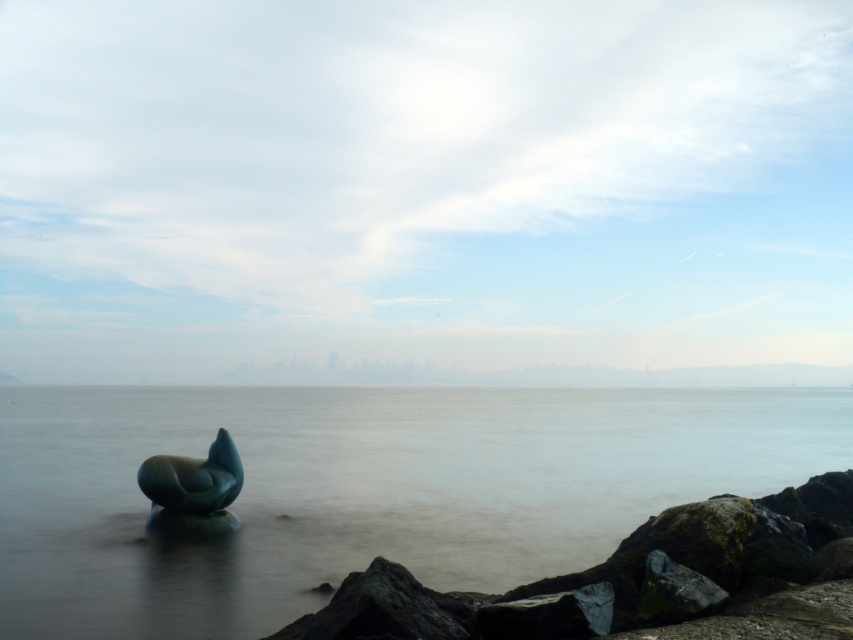
Question: Is green metallic water at center to the left of green polished stone sculpture at center from the viewer's perspective?

Choices:
 (A) no
 (B) yes

Answer: (B)

Question: Is the position of green metallic water at center less distant than that of green polished stone sculpture at center?

Choices:
 (A) yes
 (B) no

Answer: (A)

Question: Can you confirm if green metallic water at center is positioned below green polished stone sculpture at center?

Choices:
 (A) no
 (B) yes

Answer: (B)

Question: Which point appears closest to the camera in this image?

Choices:
 (A) (218, 404)
 (B) (173, 458)

Answer: (B)

Question: Which object appears farthest from the camera in this image?

Choices:
 (A) green polished stone sculpture at center
 (B) green metallic water at center

Answer: (A)